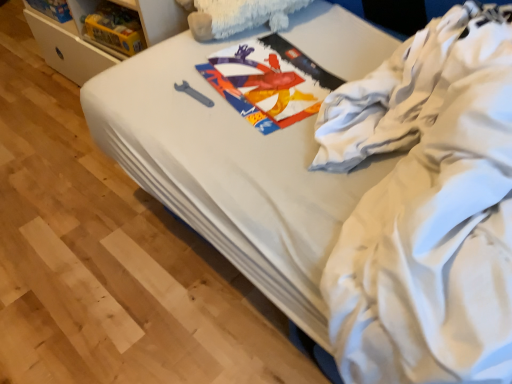
Measure the distance between gray matte wrench at center and camera.

gray matte wrench at center is 35.12 inches away from camera.

Locate an element on the screen. The width and height of the screenshot is (512, 384). gray matte wrench at center is located at coordinates (194, 93).

From the picture: What is the approximate height of gray matte wrench at center?

gray matte wrench at center is 1.13 inches tall.

What do you see at coordinates (194, 93) in the screenshot?
I see `gray matte wrench at center` at bounding box center [194, 93].

The height and width of the screenshot is (384, 512). Identify the location of white cotton shirt at upper right. (426, 208).

This screenshot has height=384, width=512. Describe the element at coordinates (426, 208) in the screenshot. I see `white cotton shirt at upper right` at that location.

The height and width of the screenshot is (384, 512). I want to click on gray matte wrench at center, so click(194, 93).

Which is more to the right, gray matte wrench at center or white cotton shirt at upper right?

white cotton shirt at upper right.

Is the position of gray matte wrench at center less distant than that of white cotton shirt at upper right?

No.

Considering the points (201, 96) and (486, 36), which point is in front, point (201, 96) or point (486, 36)?

Point (486, 36)

From the image's perspective, which object appears higher, gray matte wrench at center or white cotton shirt at upper right?

From the image's view, gray matte wrench at center is above.

From a real-world perspective, which is physically below, gray matte wrench at center or white cotton shirt at upper right?

gray matte wrench at center, from a real-world perspective.

Considering the sizes of objects gray matte wrench at center and white cotton shirt at upper right in the image provided, who is wider, gray matte wrench at center or white cotton shirt at upper right?

white cotton shirt at upper right.

Who is shorter, gray matte wrench at center or white cotton shirt at upper right?

With less height is gray matte wrench at center.

In the scene shown: Between gray matte wrench at center and white cotton shirt at upper right, which one has smaller size?

gray matte wrench at center.

Is white cotton shirt at upper right inside gray matte wrench at center?

Actually, white cotton shirt at upper right is outside gray matte wrench at center.

Can you see gray matte wrench at center touching white cotton shirt at upper right?

gray matte wrench at center and white cotton shirt at upper right are clearly separated.

Does gray matte wrench at center turn towards white cotton shirt at upper right?

No, gray matte wrench at center is not oriented towards white cotton shirt at upper right.

How different are the orientations of gray matte wrench at center and white cotton shirt at upper right in degrees?

3.16 degrees.

Measure the distance between gray matte wrench at center and white cotton shirt at upper right.

gray matte wrench at center is 18.69 inches from white cotton shirt at upper right.

Locate an element on the screen. Image resolution: width=512 pixels, height=384 pixels. equipment above the white cotton shirt at upper right (from the image's perspective) is located at coordinates (194, 93).

In the image, is white cotton shirt at upper right on the left side or the right side of gray matte wrench at center?

white cotton shirt at upper right is positioned on gray matte wrench at center's right side.

Considering the positions of objects white cotton shirt at upper right and gray matte wrench at center in the image provided, who is in front, white cotton shirt at upper right or gray matte wrench at center?

white cotton shirt at upper right.

Considering the positions of points (380, 320) and (206, 104), is point (380, 320) closer to camera compared to point (206, 104)?

Yes.

From the image's perspective, between white cotton shirt at upper right and gray matte wrench at center, which one is located above?

gray matte wrench at center is shown above in the image.

From a real-world perspective, is white cotton shirt at upper right physically below gray matte wrench at center?

No, from a real-world perspective, white cotton shirt at upper right is not below gray matte wrench at center.

Can you confirm if white cotton shirt at upper right is wider than gray matte wrench at center?

Indeed, white cotton shirt at upper right has a greater width compared to gray matte wrench at center.

Considering the sizes of objects white cotton shirt at upper right and gray matte wrench at center in the image provided, who is taller, white cotton shirt at upper right or gray matte wrench at center?

Standing taller between the two is white cotton shirt at upper right.

Is white cotton shirt at upper right smaller than gray matte wrench at center?

No, white cotton shirt at upper right is not smaller than gray matte wrench at center.

Is white cotton shirt at upper right surrounding gray matte wrench at center?

Definitely not — gray matte wrench at center is not inside white cotton shirt at upper right.

Is white cotton shirt at upper right far from gray matte wrench at center?

Actually, white cotton shirt at upper right and gray matte wrench at center are a little close together.

Is white cotton shirt at upper right positioned with its back to gray matte wrench at center?

That's not correct — white cotton shirt at upper right is not looking away from gray matte wrench at center.

Where is `equipment located behind the white cotton shirt at upper right`? equipment located behind the white cotton shirt at upper right is located at coordinates pos(194,93).

Find the location of a particular element. equipment behind the white cotton shirt at upper right is located at coordinates (194, 93).

This screenshot has width=512, height=384. In order to click on equipment that appears above the white cotton shirt at upper right (from the image's perspective) in this screenshot , I will do tap(194, 93).